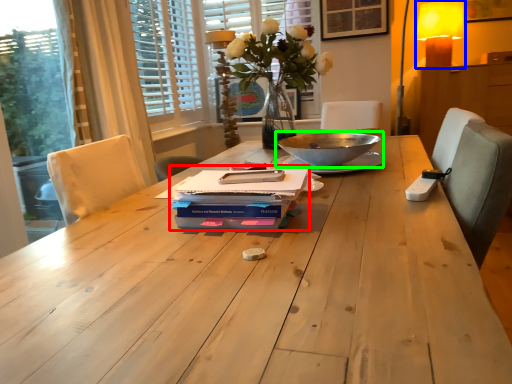
Question: Which object is positioned closest to paperback book (highlighted by a red box)? Select from table lamp (highlighted by a blue box) and bowl (highlighted by a green box).

Choices:
 (A) table lamp
 (B) bowl

Answer: (B)